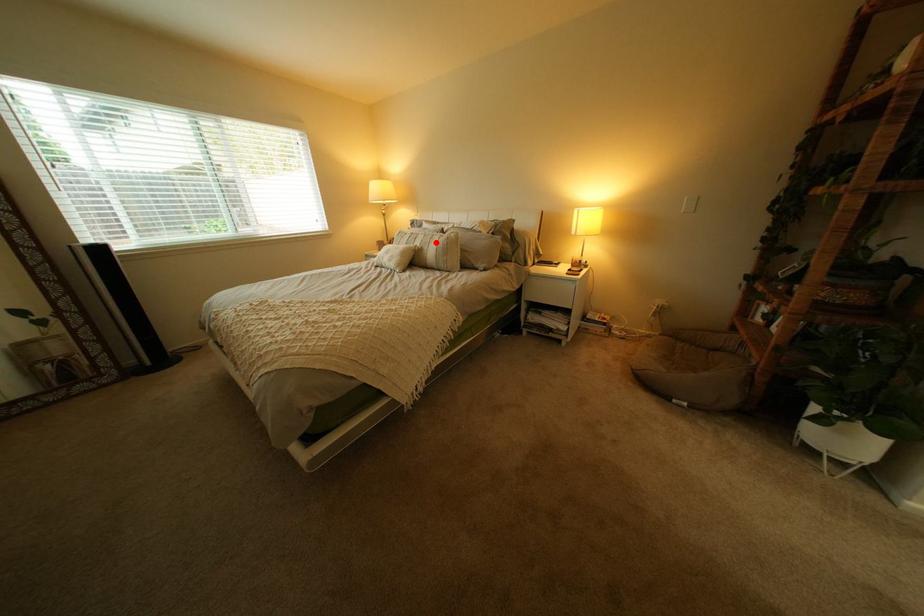
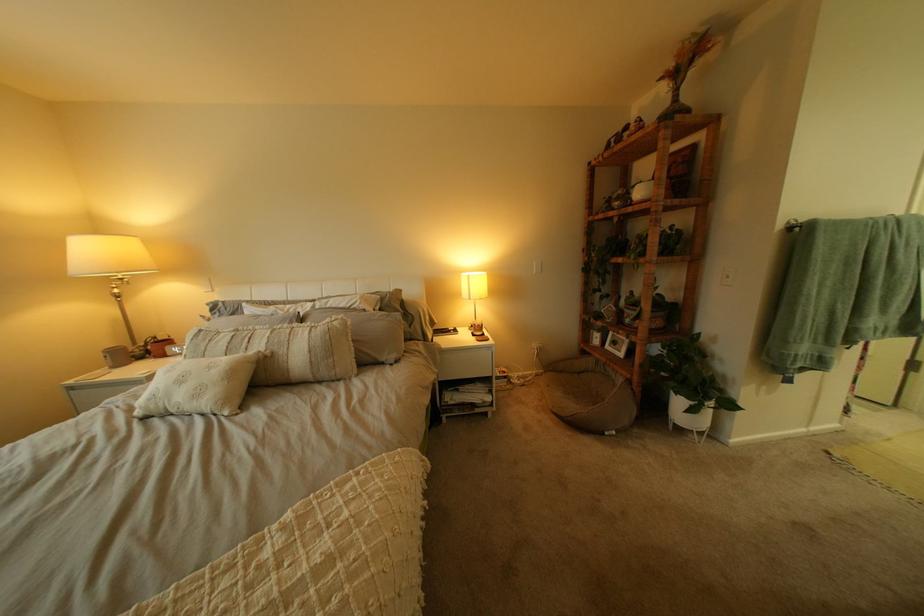
Locate, in the second image, the point that corresponds to the highlighted location in the first image.

(281, 342)